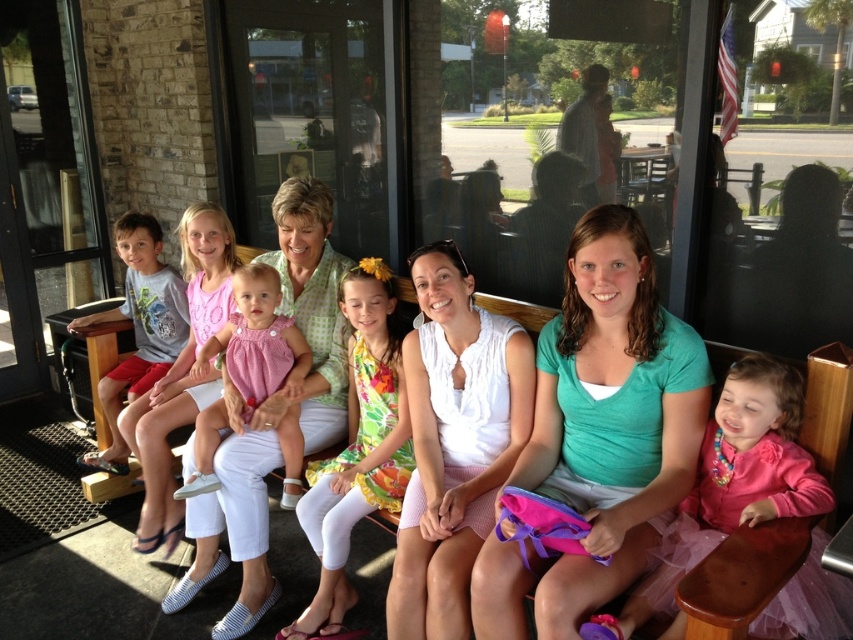
Question: Is white cotton dress at center bigger than matte gray t-shirt at left?

Choices:
 (A) no
 (B) yes

Answer: (A)

Question: Which point is closer to the camera?

Choices:
 (A) (213, 481)
 (B) (341, 396)
 (C) (160, 348)
 (D) (91, 340)

Answer: (A)

Question: From the image, what is the correct spatial relationship of white cotton dress at center in relation to matte gray t-shirt at left?

Choices:
 (A) above
 (B) below

Answer: (A)

Question: Which object is positioned farthest from the pink fabric dress at center?

Choices:
 (A) knitted pink dress at center
 (B) teal satin shirt at center

Answer: (B)

Question: Which point is closer to the camera?

Choices:
 (A) (291, 492)
 (B) (242, 400)
 (C) (151, 298)

Answer: (A)

Question: Does floral dress at center appear on the right side of matte gray t-shirt at left?

Choices:
 (A) yes
 (B) no

Answer: (A)